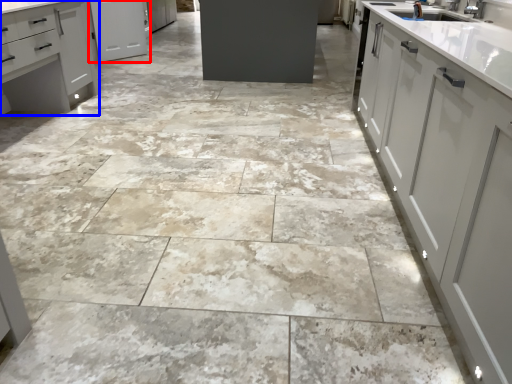
Question: Which object appears closest to the camera in this image, cabinetry (highlighted by a red box) or cabinetry (highlighted by a blue box)?

Choices:
 (A) cabinetry
 (B) cabinetry

Answer: (B)